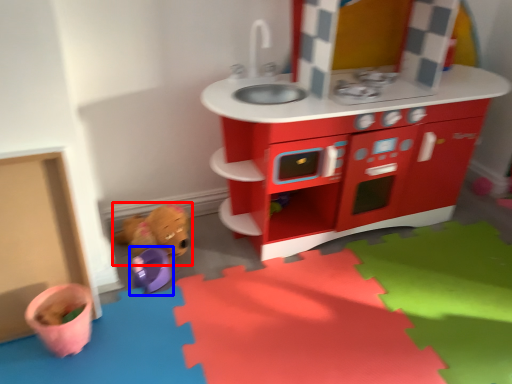
Question: Which object appears closest to the camera in this image, toy (highlighted by a red box) or toy (highlighted by a blue box)?

Choices:
 (A) toy
 (B) toy

Answer: (B)